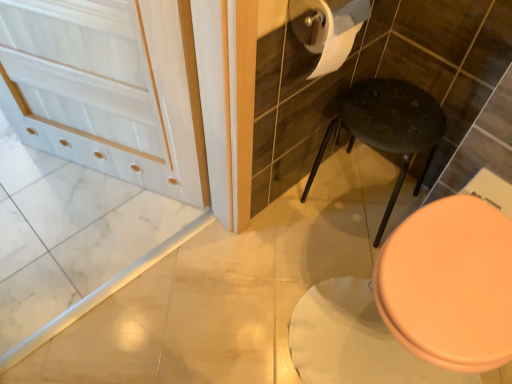
Question: Would you consider white matte screen door at upper left to be distant from dark speckled plastic stool at center?

Choices:
 (A) no
 (B) yes

Answer: (A)

Question: Can you see white matte screen door at upper left touching dark speckled plastic stool at center?

Choices:
 (A) yes
 (B) no

Answer: (B)

Question: Could you tell me if white matte screen door at upper left is turned towards dark speckled plastic stool at center?

Choices:
 (A) no
 (B) yes

Answer: (A)

Question: Considering the relative sizes of white matte screen door at upper left and dark speckled plastic stool at center in the image provided, is white matte screen door at upper left taller than dark speckled plastic stool at center?

Choices:
 (A) yes
 (B) no

Answer: (A)

Question: Can you confirm if white matte screen door at upper left is wider than dark speckled plastic stool at center?

Choices:
 (A) no
 (B) yes

Answer: (A)

Question: Based on their sizes in the image, would you say white matte toilet paper at upper right is bigger or smaller than pink glossy toilet seat at lower right?

Choices:
 (A) big
 (B) small

Answer: (B)

Question: Relative to pink glossy toilet seat at lower right, is white matte toilet paper at upper right in front or behind?

Choices:
 (A) front
 (B) behind

Answer: (B)

Question: Considering the relative positions of white matte toilet paper at upper right and pink glossy toilet seat at lower right in the image provided, is white matte toilet paper at upper right to the left or to the right of pink glossy toilet seat at lower right?

Choices:
 (A) right
 (B) left

Answer: (B)

Question: Is white matte toilet paper at upper right taller or shorter than pink glossy toilet seat at lower right?

Choices:
 (A) tall
 (B) short

Answer: (B)

Question: In terms of height, does white matte screen door at upper left look taller or shorter compared to white matte toilet paper at upper right?

Choices:
 (A) tall
 (B) short

Answer: (A)

Question: Relative to white matte toilet paper at upper right, is white matte screen door at upper left in front or behind?

Choices:
 (A) behind
 (B) front

Answer: (A)

Question: From the image's perspective, is white matte screen door at upper left above or below white matte toilet paper at upper right?

Choices:
 (A) above
 (B) below

Answer: (B)

Question: Considering the positions of white matte screen door at upper left and white matte toilet paper at upper right in the image, is white matte screen door at upper left bigger or smaller than white matte toilet paper at upper right?

Choices:
 (A) small
 (B) big

Answer: (B)

Question: Considering the positions of pink glossy toilet seat at lower right and white matte screen door at upper left in the image, is pink glossy toilet seat at lower right taller or shorter than white matte screen door at upper left?

Choices:
 (A) short
 (B) tall

Answer: (A)

Question: Is point (389, 281) closer or farther from the camera than point (79, 3)?

Choices:
 (A) farther
 (B) closer

Answer: (B)